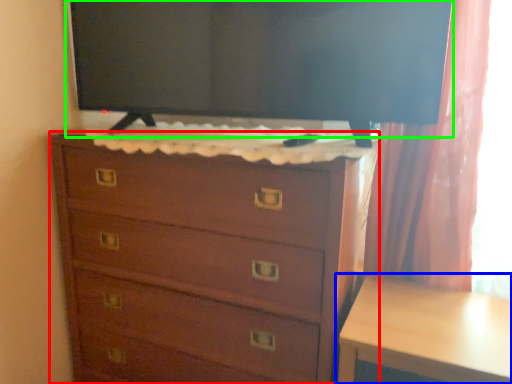
Question: Based on their relative distances, which object is farther from chest of drawers (highlighted by a red box)? Choose from table (highlighted by a blue box) and tv show (highlighted by a green box).

Choices:
 (A) table
 (B) tv show

Answer: (B)